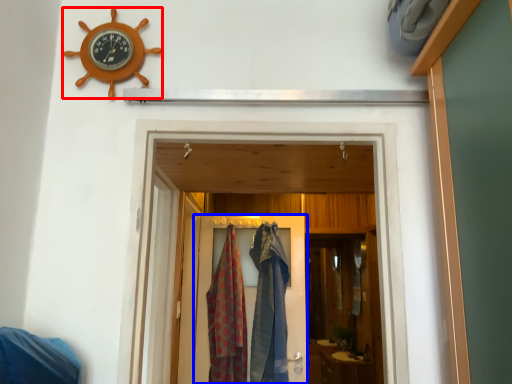
Question: Which object appears farthest to the camera in this image, wall clock (highlighted by a red box) or door (highlighted by a blue box)?

Choices:
 (A) wall clock
 (B) door

Answer: (B)